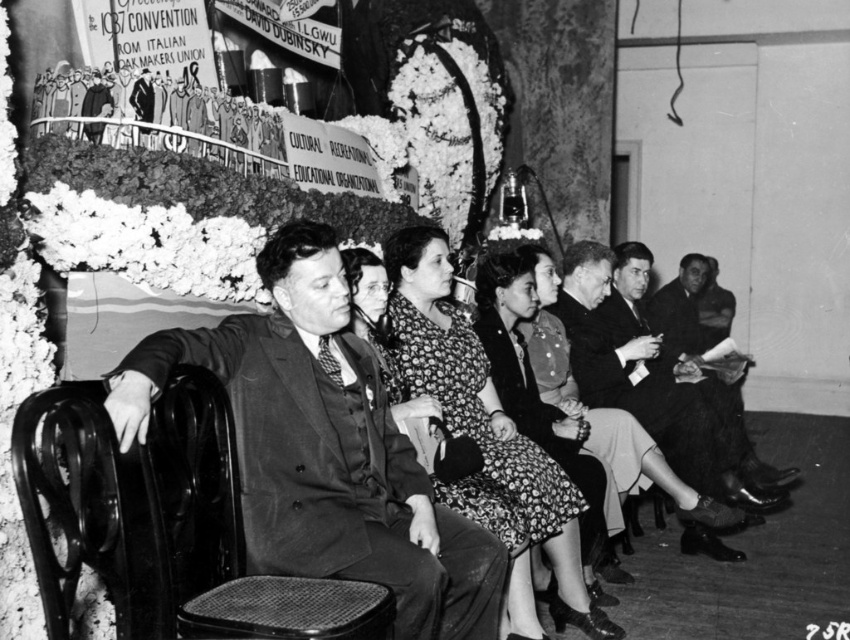
Based on the scene description and the objects provided, what is the position of the smooth black suit at center in the image?

The smooth black suit at center is located at point coordinates of 0.700 in the x axis and 0.382 in the y axis.